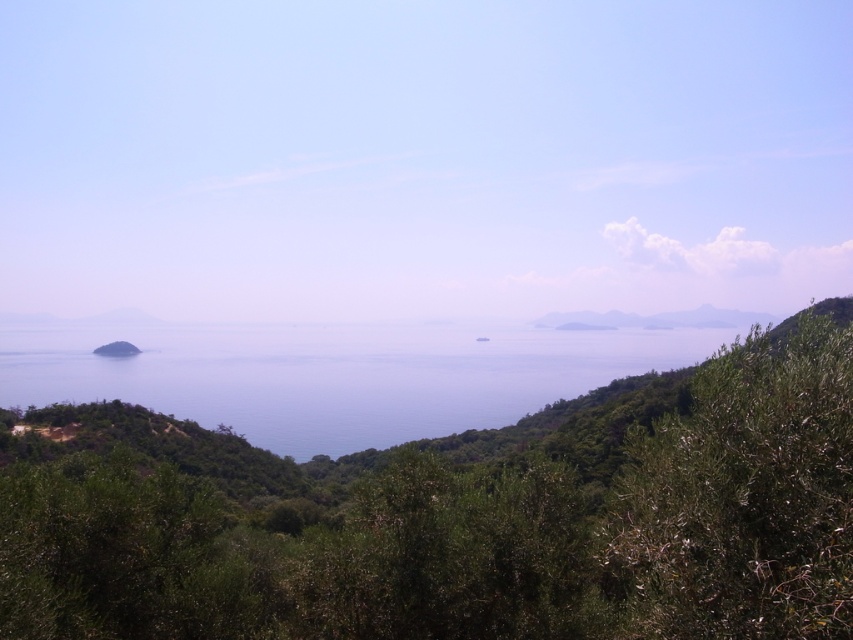
You are standing at the edge of the green matte island at lower left and want to reach the blue water at center. Based on the scene description, which direction should you head towards?

The blue water at center is much taller than the green matte island at lower left, so you should head towards the direction where the elevation increases to reach the blue water at center.

You are standing at the point labeled point (126, 352) and want to walk towards the point labeled point (669, 497). Which direction should you move relative to your current position?

You should move towards the point (669, 497), which is closer to you than the point (126, 352), so you need to walk forward towards it.